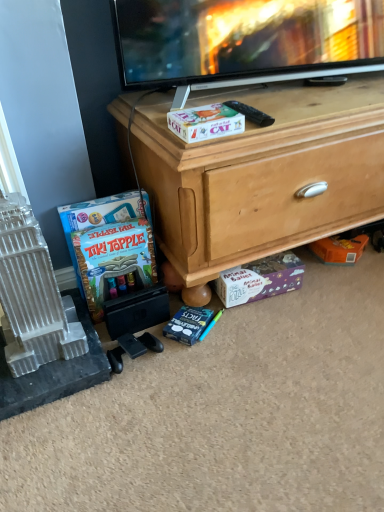
At what (x,y) coordinates should I click in order to perform the action: click on vacant region to the right of white plastic building at left. Please return your answer as a coordinate pair (x, y). The height and width of the screenshot is (512, 384). Looking at the image, I should click on (111, 343).